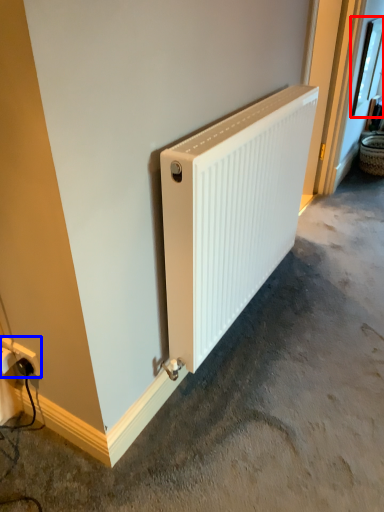
Question: Which point is closer to the camera, window (highlighted by a red box) or power plugs and sockets (highlighted by a blue box)?

Choices:
 (A) window
 (B) power plugs and sockets

Answer: (B)